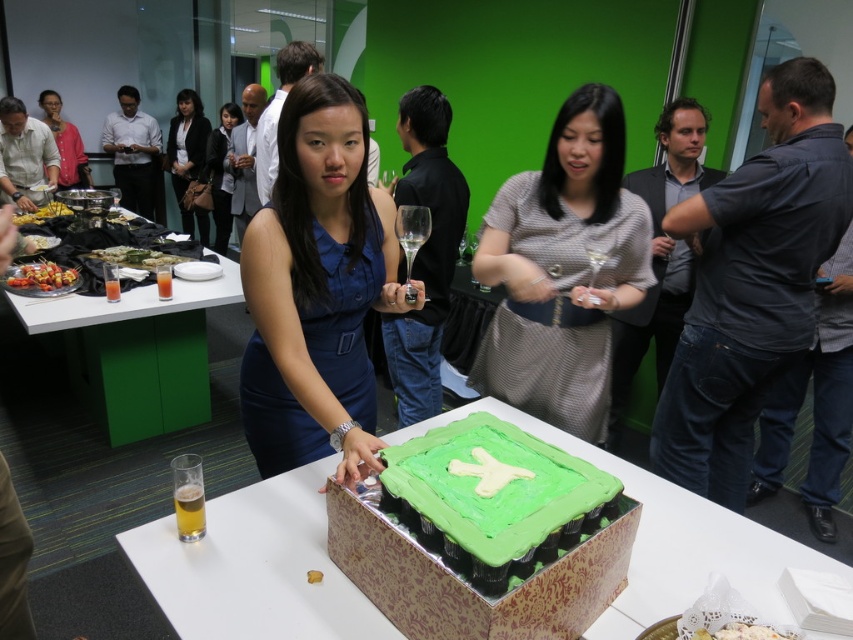
Consider the image. You are at a party and see two types of skewers displayed on a table. The golden brown crispy skewers at left and the green matte skewers at left. Which one is more to the left?

The golden brown crispy skewers at left is more on the left side of the green matte skewers at left.